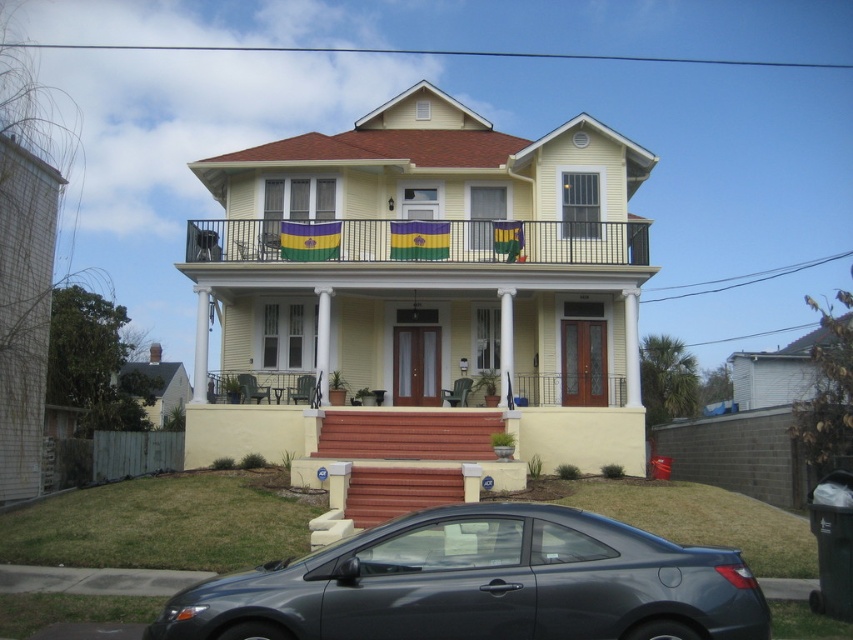
Describe the element at coordinates (480, 584) in the screenshot. I see `satin black car at lower center` at that location.

Is point (535, 518) closer to viewer compared to point (265, 262)?

Yes.

This screenshot has height=640, width=853. I want to click on satin black car at lower center, so click(x=480, y=584).